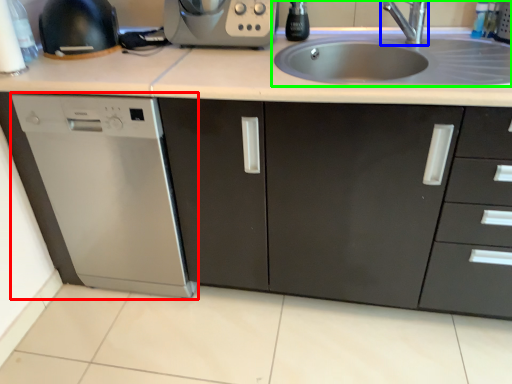
Question: Which object is positioned farthest from home appliance (highlighted by a red box)? Select from tap (highlighted by a blue box) and sink (highlighted by a green box).

Choices:
 (A) tap
 (B) sink

Answer: (A)